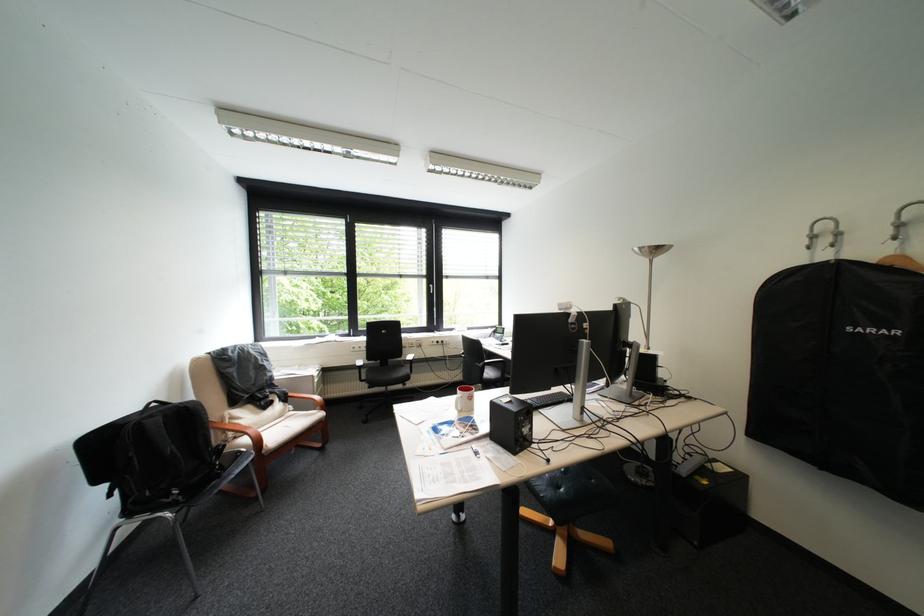
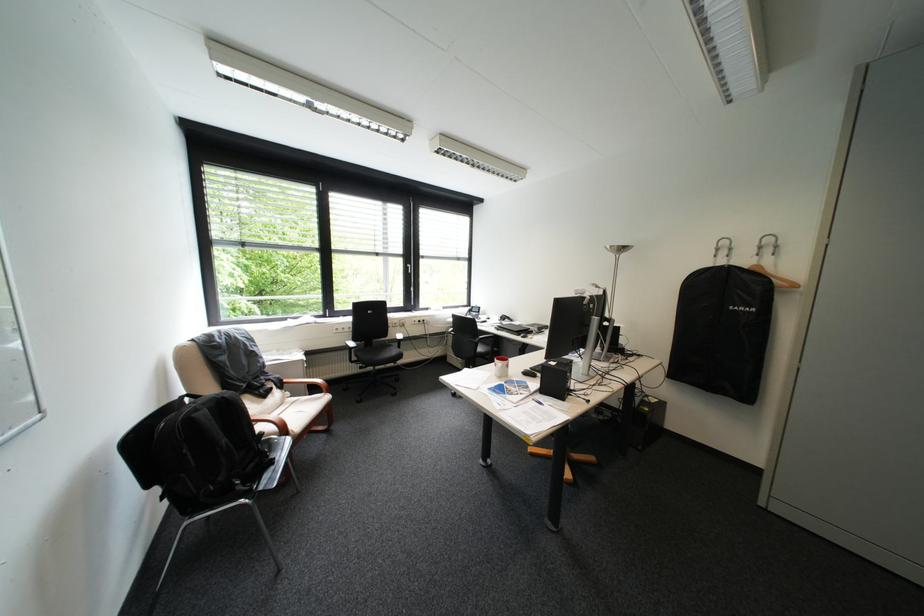
The point at (299, 394) is marked in the first image. Where is the corresponding point in the second image?

(294, 381)